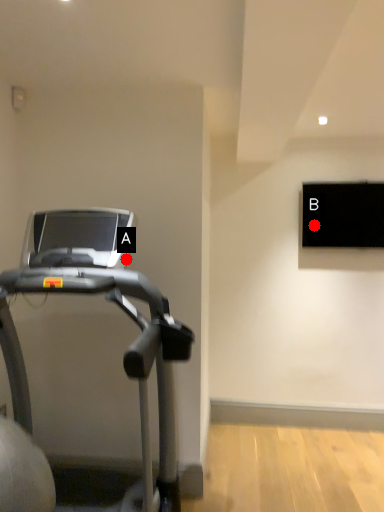
Question: Two points are circled on the image, labeled by A and B beside each circle. Among these points, which one is nearest to the camera?

Choices:
 (A) A is closer
 (B) B is closer

Answer: (A)